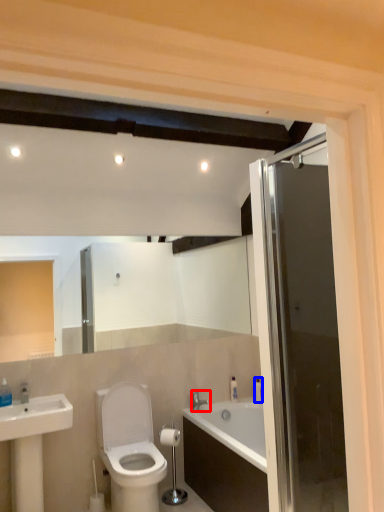
Question: Among these objects, which one is nearest to the camera, tap (highlighted by a red box) or toiletry (highlighted by a blue box)?

Choices:
 (A) tap
 (B) toiletry

Answer: (A)